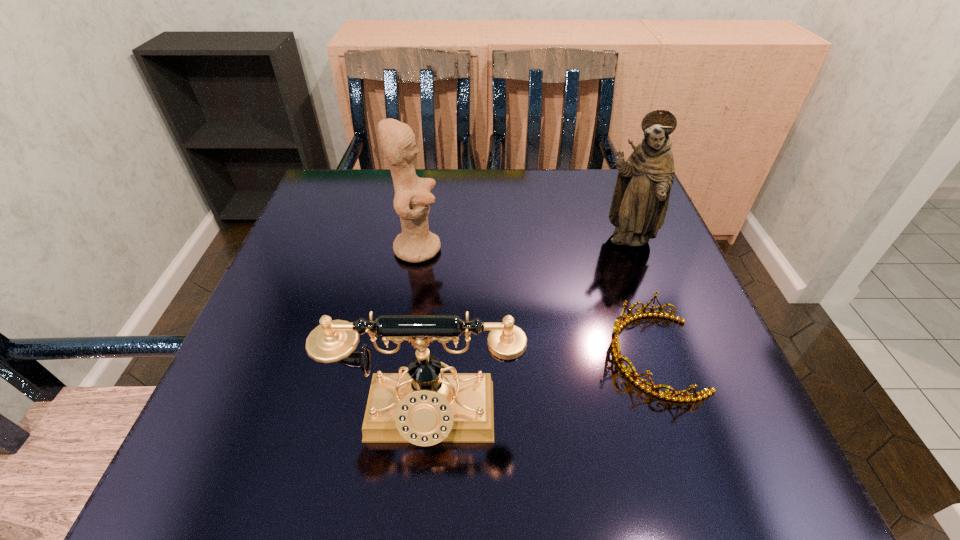
Locate an element on the screen. The width and height of the screenshot is (960, 540). object that is the nearest to the left figurine is located at coordinates (425, 406).

At what (x,y) coordinates should I click in order to perform the action: click on free space that satisfies the following two spatial constraints: 1. on the front-facing side of the right figurine; 2. on the front-facing side of the tiara. Please return your answer as a coordinate pair (x, y). This screenshot has width=960, height=540. Looking at the image, I should click on (670, 355).

You are a GUI agent. You are given a task and a screenshot of the screen. Output one action in this format:
    pyautogui.click(x=<x>, y=<y>)
    Task: Click on the free space that satisfies the following two spatial constraints: 1. on the front-facing side of the shortest object; 2. on the dial of the third tallest object
    
    Given the screenshot: What is the action you would take?
    pyautogui.click(x=674, y=417)

You are a GUI agent. You are given a task and a screenshot of the screen. Output one action in this format:
    pyautogui.click(x=<x>, y=<y>)
    Task: Click on the free point that satisfies the following two spatial constraints: 1. on the front-facing side of the right figurine; 2. on the front-facing side of the shortest object
    
    Given the screenshot: What is the action you would take?
    pyautogui.click(x=670, y=355)

Where is `vacant region that satisfies the following two spatial constraints: 1. on the front-facing side of the right figurine; 2. on the front-facing side of the tiara`? The width and height of the screenshot is (960, 540). vacant region that satisfies the following two spatial constraints: 1. on the front-facing side of the right figurine; 2. on the front-facing side of the tiara is located at coordinates (670, 355).

You are a GUI agent. You are given a task and a screenshot of the screen. Output one action in this format:
    pyautogui.click(x=<x>, y=<y>)
    Task: Click on the blank area in the image that satisfies the following two spatial constraints: 1. on the front-facing side of the right figurine; 2. on the front-facing side of the tiara
    
    Given the screenshot: What is the action you would take?
    pyautogui.click(x=670, y=355)

You are a GUI agent. You are given a task and a screenshot of the screen. Output one action in this format:
    pyautogui.click(x=<x>, y=<y>)
    Task: Click on the free space that satisfies the following two spatial constraints: 1. on the front-facing side of the right figurine; 2. on the front-facing side of the tiara
    
    Given the screenshot: What is the action you would take?
    [670, 355]